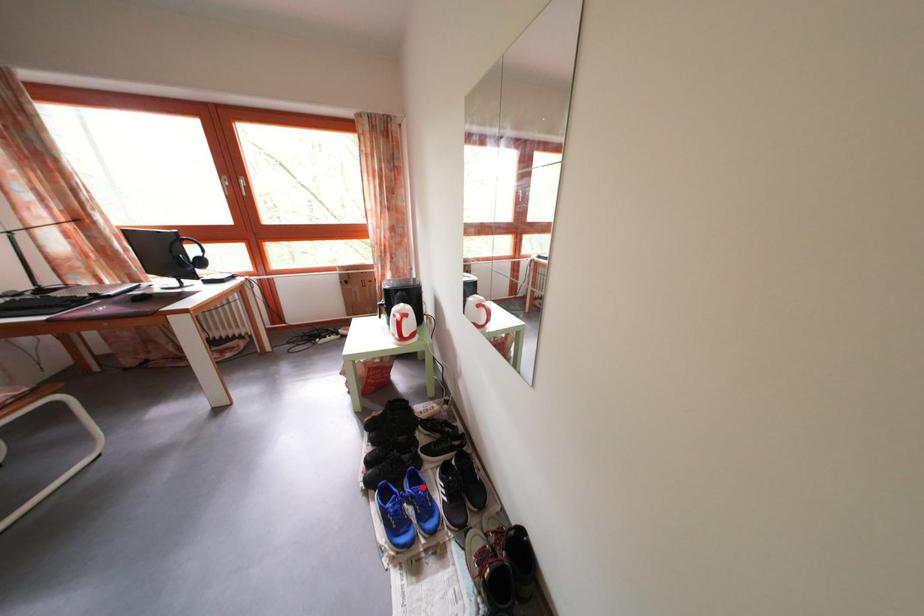
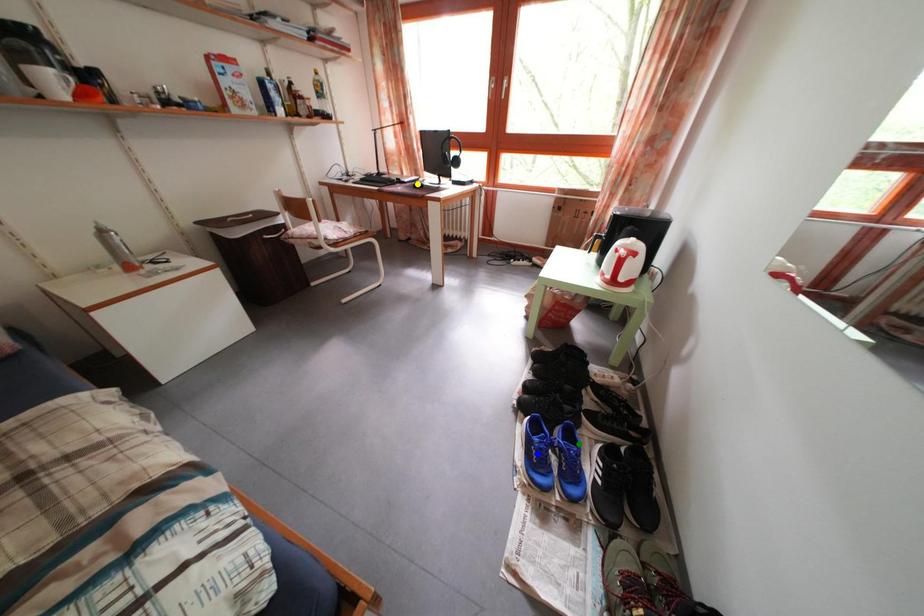
Question: I am providing you with two images of the same scene from different viewpoints. A red point is marked on the first image. You are given multiple points on the second image. Can you choose the point in image 2 that corresponds to the point in image 1?

Choices:
 (A) green point
 (B) yellow point
 (C) blue point

Answer: (A)